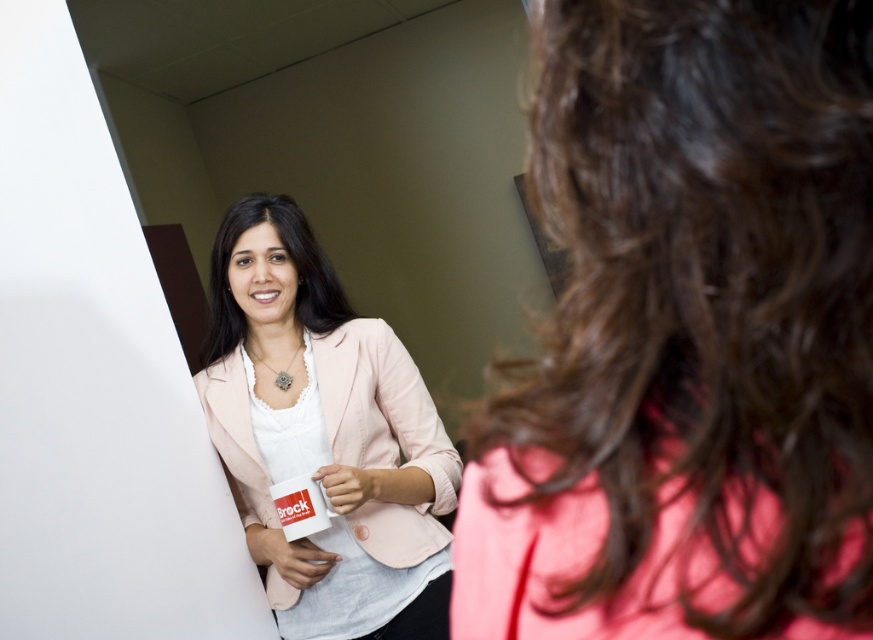
Question: Which of the following is the closest to the observer?

Choices:
 (A) (610, 228)
 (B) (331, 385)

Answer: (A)

Question: Can you confirm if matte pink blazer at upper left is positioned to the right of matte pink blazer at center?

Choices:
 (A) yes
 (B) no

Answer: (A)

Question: Does matte pink blazer at upper left lie behind matte pink blazer at center?

Choices:
 (A) yes
 (B) no

Answer: (B)

Question: Can you confirm if matte pink blazer at upper left is bigger than matte pink blazer at center?

Choices:
 (A) yes
 (B) no

Answer: (B)